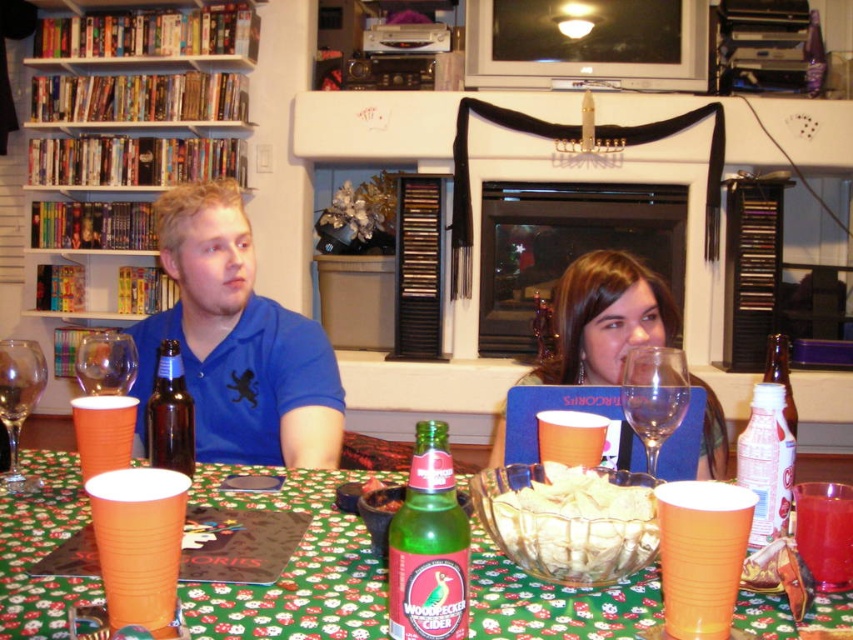
You are organizing the items on the table for a game night. You need to move the translucent plastic bottle at center right closer to the edge of the table so it doesn not block the laptop. Can you move it without moving the matte blue laptop at center first?

The matte blue laptop at center is further to the viewer than the translucent plastic bottle at center right, so you can move the translucent plastic bottle at center right without needing to move the laptop first.

You are at a party and want to pour cider from the green glass bottle at center into the orange paper cup at lower left. Will the cup hold all the cider from the bottle?

The green glass bottle at center is larger than the orange paper cup at lower left. Therefore, the cup may not hold all the cider from the bottle since the bottle has a greater capacity.